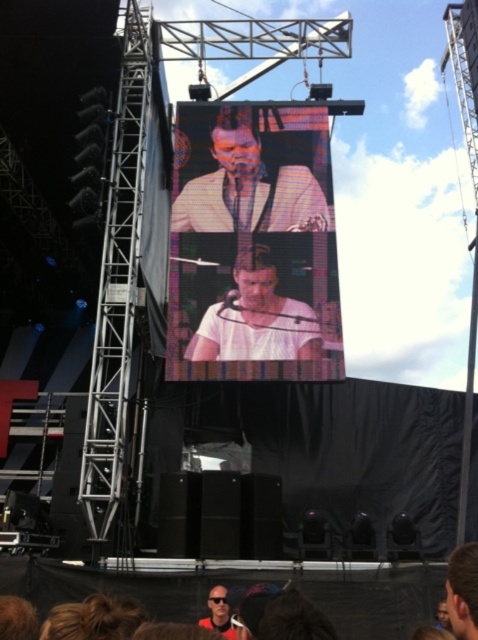
Who is more distant from viewer, [240,252] or [225,348]?

The point [240,252] is more distant.

Between point (282, 186) and point (263, 301), which one is positioned in front?

Point (263, 301)

Measure the distance between point (325, 348) and camera.

Point (325, 348) is 64.35 meters away from camera.

Where is `pixelated screen at center`? The width and height of the screenshot is (478, 640). pixelated screen at center is located at coordinates (252, 244).

Between matte white shirt at center and smooth white shirt at center, which one has less height?

With less height is smooth white shirt at center.

Which is above, matte white shirt at center or smooth white shirt at center?

matte white shirt at center is higher up.

Where is `matte white shirt at center`? This screenshot has height=640, width=478. matte white shirt at center is located at coordinates (252, 179).

Is point (291, 200) positioned behind point (228, 634)?

Yes.

Does matte white shirt at center have a larger size compared to matte black sunglasses at lower center?

Correct, matte white shirt at center is larger in size than matte black sunglasses at lower center.

The width and height of the screenshot is (478, 640). I want to click on matte white shirt at center, so click(252, 179).